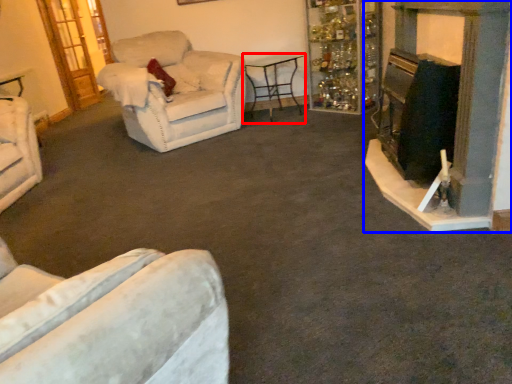
Question: Which object is further to the camera taking this photo, table (highlighted by a red box) or fireplace (highlighted by a blue box)?

Choices:
 (A) table
 (B) fireplace

Answer: (A)